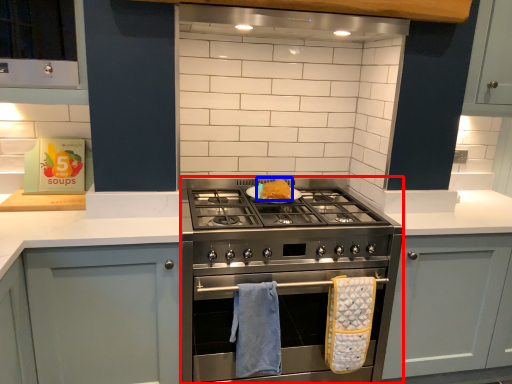
Question: Among these objects, which one is farthest to the camera, appliance (highlighted by a red box) or food (highlighted by a blue box)?

Choices:
 (A) appliance
 (B) food

Answer: (B)